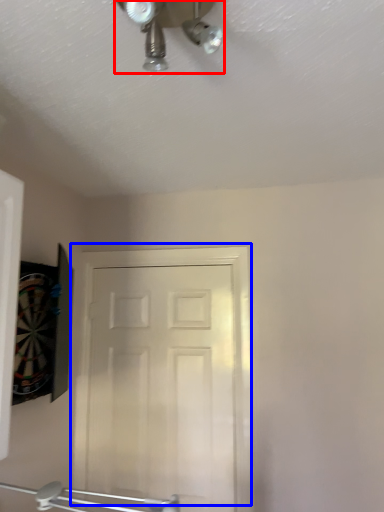
Question: Which point is closer to the camera, mechanical fan (highlighted by a red box) or door (highlighted by a blue box)?

Choices:
 (A) mechanical fan
 (B) door

Answer: (A)